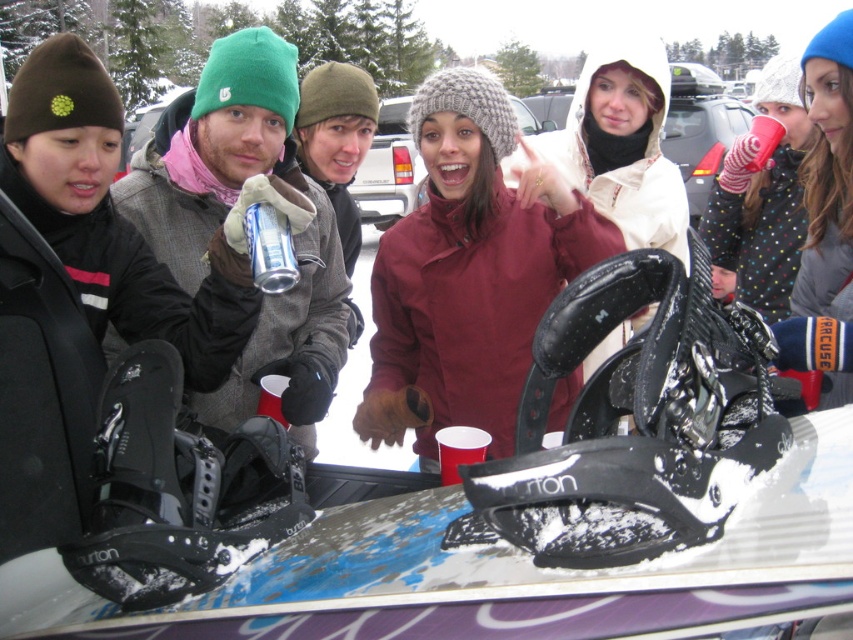
Question: Which point is closer to the camera taking this photo?

Choices:
 (A) (166, 236)
 (B) (267, 209)
 (C) (38, 145)
 (D) (712, 204)

Answer: (B)

Question: Does matte gray snowboard at center have a greater width compared to polka dot sweater at center?

Choices:
 (A) no
 (B) yes

Answer: (B)

Question: Can you confirm if matte gray snowboard at center is positioned to the left of polka dot sweater at center?

Choices:
 (A) yes
 (B) no

Answer: (A)

Question: Does matte green beanie at left appear on the left side of polka dot sweater at center?

Choices:
 (A) yes
 (B) no

Answer: (A)

Question: Which point is closer to the camera taking this photo?

Choices:
 (A) (791, 259)
 (B) (473, 333)
 (C) (151, 202)

Answer: (C)

Question: Which point is closer to the camera?

Choices:
 (A) (483, 186)
 (B) (238, 97)
 (C) (137, 284)

Answer: (C)